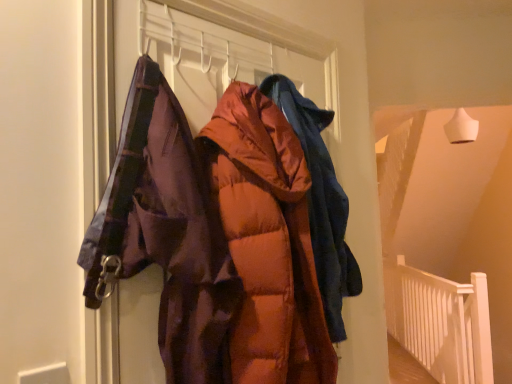
The height and width of the screenshot is (384, 512). In order to click on white wooden balustrade at lower right in this screenshot , I will do `click(440, 322)`.

This screenshot has width=512, height=384. Describe the element at coordinates (267, 241) in the screenshot. I see `orange puffy jacket at center, the 1th jacket from the front` at that location.

The image size is (512, 384). Find the location of `matte orange puffer jacket at center, the first jacket in the back-to-front sequence`. matte orange puffer jacket at center, the first jacket in the back-to-front sequence is located at coordinates (x=321, y=202).

Locate an element on the screen. The width and height of the screenshot is (512, 384). white wooden balustrade at lower right is located at coordinates (440, 322).

From the image's perspective, is white wooden balustrade at lower right positioned above or below matte orange puffer jacket at center, marked as the 2th jacket in a front-to-back arrangement?

white wooden balustrade at lower right is below matte orange puffer jacket at center, marked as the 2th jacket in a front-to-back arrangement.

Between white wooden balustrade at lower right and matte orange puffer jacket at center, marked as the 2th jacket in a front-to-back arrangement, which one appears on the left side from the viewer's perspective?

matte orange puffer jacket at center, marked as the 2th jacket in a front-to-back arrangement, is more to the left.

Is matte orange puffer jacket at center, the first jacket in the back-to-front sequence, inside white wooden balustrade at lower right?

No.

Which object is further away from the camera, white wooden balustrade at lower right or matte orange puffer jacket at center, marked as the 2th jacket in a front-to-back arrangement?

white wooden balustrade at lower right is further from the camera.

Does orange puffy jacket at center, the second jacket in the back-to-front sequence, have a larger size compared to white wooden balustrade at lower right?

Incorrect, orange puffy jacket at center, the second jacket in the back-to-front sequence, is not larger than white wooden balustrade at lower right.

From a real-world perspective, who is located lower, orange puffy jacket at center, the 1th jacket from the front, or white wooden balustrade at lower right?

white wooden balustrade at lower right, from a real-world perspective.

How far apart are orange puffy jacket at center, the 1th jacket from the front, and white wooden balustrade at lower right?

2.96 meters.

From a real-world perspective, count 1st jackets upward from the white wooden balustrade at lower right and point to it. Please provide its 2D coordinates.

[(267, 241)]

Is white wooden balustrade at lower right not inside orange puffy jacket at center, the 1th jacket from the front?

Indeed, white wooden balustrade at lower right is completely outside orange puffy jacket at center, the 1th jacket from the front.

Is white wooden balustrade at lower right bigger or smaller than orange puffy jacket at center, the 1th jacket from the front?

white wooden balustrade at lower right is bigger than orange puffy jacket at center, the 1th jacket from the front.

Is white wooden balustrade at lower right wider or thinner than orange puffy jacket at center, the 1th jacket from the front?

Clearly, white wooden balustrade at lower right has less width compared to orange puffy jacket at center, the 1th jacket from the front.

Is white wooden balustrade at lower right taller or shorter than orange puffy jacket at center, the second jacket in the back-to-front sequence?

Considering their sizes, white wooden balustrade at lower right has more height than orange puffy jacket at center, the second jacket in the back-to-front sequence.

Is matte orange puffer jacket at center, the first jacket in the back-to-front sequence, next to white wooden balustrade at lower right and touching it?

No, matte orange puffer jacket at center, the first jacket in the back-to-front sequence, is not making contact with white wooden balustrade at lower right.

Is matte orange puffer jacket at center, marked as the 2th jacket in a front-to-back arrangement, positioned behind white wooden balustrade at lower right?

That is False.

How many degrees apart are the facing directions of matte orange puffer jacket at center, marked as the 2th jacket in a front-to-back arrangement, and white wooden balustrade at lower right?

The angle between the facing direction of matte orange puffer jacket at center, marked as the 2th jacket in a front-to-back arrangement, and the facing direction of white wooden balustrade at lower right is 135 degrees.

I want to click on balustrade behind the matte orange puffer jacket at center, the first jacket in the back-to-front sequence, so click(x=440, y=322).

You are a GUI agent. You are given a task and a screenshot of the screen. Output one action in this format:
    pyautogui.click(x=<x>, y=<y>)
    Task: Click on the jacket behind the orange puffy jacket at center, the 1th jacket from the front
    This screenshot has height=384, width=512.
    Given the screenshot: What is the action you would take?
    pyautogui.click(x=321, y=202)

Does point (305, 121) lie behind point (298, 158)?

Yes.

Between matte orange puffer jacket at center, the first jacket in the back-to-front sequence, and orange puffy jacket at center, the 1th jacket from the front, which one is positioned behind?

matte orange puffer jacket at center, the first jacket in the back-to-front sequence, is more distant.

Consider the image. Which of these two, orange puffy jacket at center, the second jacket in the back-to-front sequence, or matte orange puffer jacket at center, marked as the 2th jacket in a front-to-back arrangement, stands taller?

Standing taller between the two is orange puffy jacket at center, the second jacket in the back-to-front sequence.

Is orange puffy jacket at center, the 1th jacket from the front, aimed at matte orange puffer jacket at center, marked as the 2th jacket in a front-to-back arrangement?

No, orange puffy jacket at center, the 1th jacket from the front, does not turn towards matte orange puffer jacket at center, marked as the 2th jacket in a front-to-back arrangement.

Does orange puffy jacket at center, the second jacket in the back-to-front sequence, appear on the left side of matte orange puffer jacket at center, marked as the 2th jacket in a front-to-back arrangement?

Yes.

Locate an element on the screen. The width and height of the screenshot is (512, 384). balustrade lying below the matte orange puffer jacket at center, the first jacket in the back-to-front sequence (from the image's perspective) is located at coordinates (440, 322).

The height and width of the screenshot is (384, 512). Find the location of `balustrade behind the orange puffy jacket at center, the 1th jacket from the front`. balustrade behind the orange puffy jacket at center, the 1th jacket from the front is located at coordinates (x=440, y=322).

Looking at the image, which one is located closer to white wooden balustrade at lower right, matte orange puffer jacket at center, marked as the 2th jacket in a front-to-back arrangement, or orange puffy jacket at center, the 1th jacket from the front?

matte orange puffer jacket at center, marked as the 2th jacket in a front-to-back arrangement, is closer to white wooden balustrade at lower right.

Based on their spatial positions, is orange puffy jacket at center, the 1th jacket from the front, or white wooden balustrade at lower right closer to matte orange puffer jacket at center, the first jacket in the back-to-front sequence?

orange puffy jacket at center, the 1th jacket from the front, is positioned closer to the anchor matte orange puffer jacket at center, the first jacket in the back-to-front sequence.

From the image, which object appears to be farther from orange puffy jacket at center, the second jacket in the back-to-front sequence, matte orange puffer jacket at center, marked as the 2th jacket in a front-to-back arrangement, or white wooden balustrade at lower right?

Based on the image, white wooden balustrade at lower right appears to be further to orange puffy jacket at center, the second jacket in the back-to-front sequence.

Considering their positions, is white wooden balustrade at lower right positioned closer to matte orange puffer jacket at center, marked as the 2th jacket in a front-to-back arrangement, than orange puffy jacket at center, the 1th jacket from the front?

orange puffy jacket at center, the 1th jacket from the front, lies closer to matte orange puffer jacket at center, marked as the 2th jacket in a front-to-back arrangement, than the other object.

Which object lies nearer to the anchor point white wooden balustrade at lower right, orange puffy jacket at center, the 1th jacket from the front, or matte orange puffer jacket at center, the first jacket in the back-to-front sequence?

matte orange puffer jacket at center, the first jacket in the back-to-front sequence, lies closer to white wooden balustrade at lower right than the other object.

Based on their spatial positions, is white wooden balustrade at lower right or matte orange puffer jacket at center, marked as the 2th jacket in a front-to-back arrangement, further from orange puffy jacket at center, the 1th jacket from the front?

The object further to orange puffy jacket at center, the 1th jacket from the front, is white wooden balustrade at lower right.

Locate an element on the screen. The height and width of the screenshot is (384, 512). jacket between orange puffy jacket at center, the second jacket in the back-to-front sequence, and white wooden balustrade at lower right, along the z-axis is located at coordinates (321, 202).